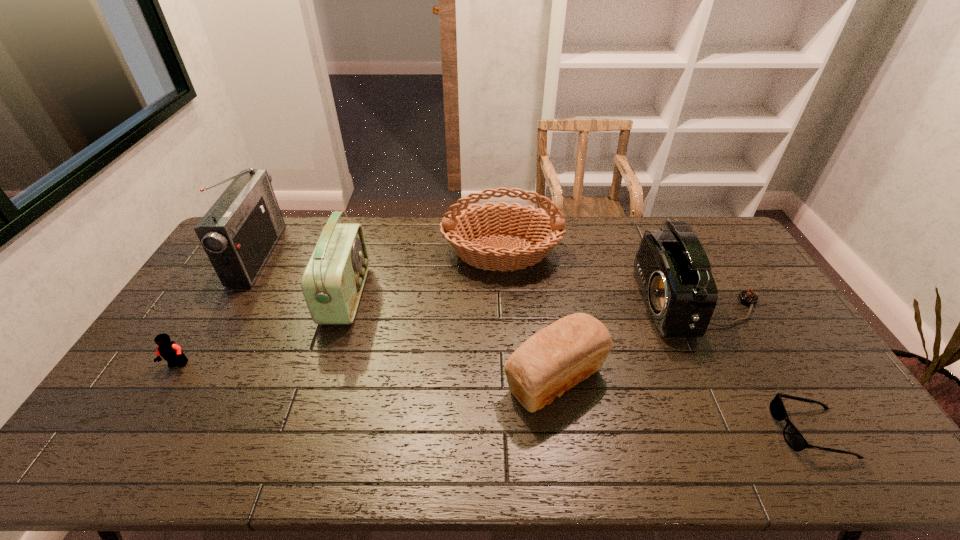
Find the location of a particular element. The width and height of the screenshot is (960, 540). the leftmost radio receiver is located at coordinates (238, 233).

What are the coordinates of `the tallest object` in the screenshot? It's located at (238, 233).

At what (x,y) coordinates should I click in order to perform the action: click on basket. Please return your answer as a coordinate pair (x, y). This screenshot has height=540, width=960. Looking at the image, I should click on (544, 229).

What are the coordinates of `the fifth object from right to left` in the screenshot? It's located at click(332, 283).

I want to click on the rightmost radio receiver, so click(672, 268).

Find the location of `the fifth tallest object`. the fifth tallest object is located at coordinates click(556, 358).

Where is `Lego`? Lego is located at coordinates (171, 352).

Where is `the shortest object`? the shortest object is located at coordinates (795, 440).

Locate an element on the screen. The image size is (960, 540). free location located 0.220m on the front-facing side of the leftmost radio receiver is located at coordinates (332, 255).

In order to click on free space located 0.090m on the front of the basket in this screenshot , I will do `click(504, 300)`.